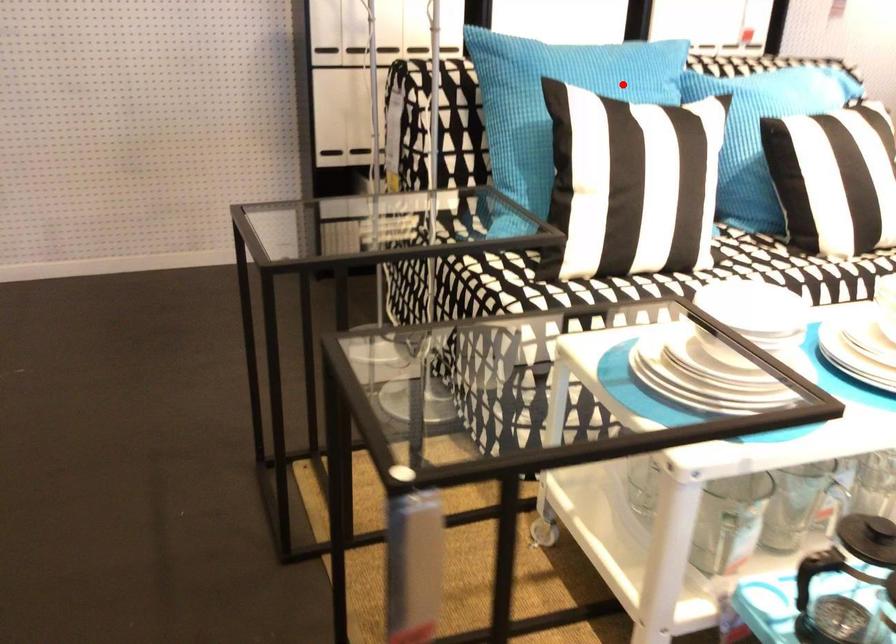
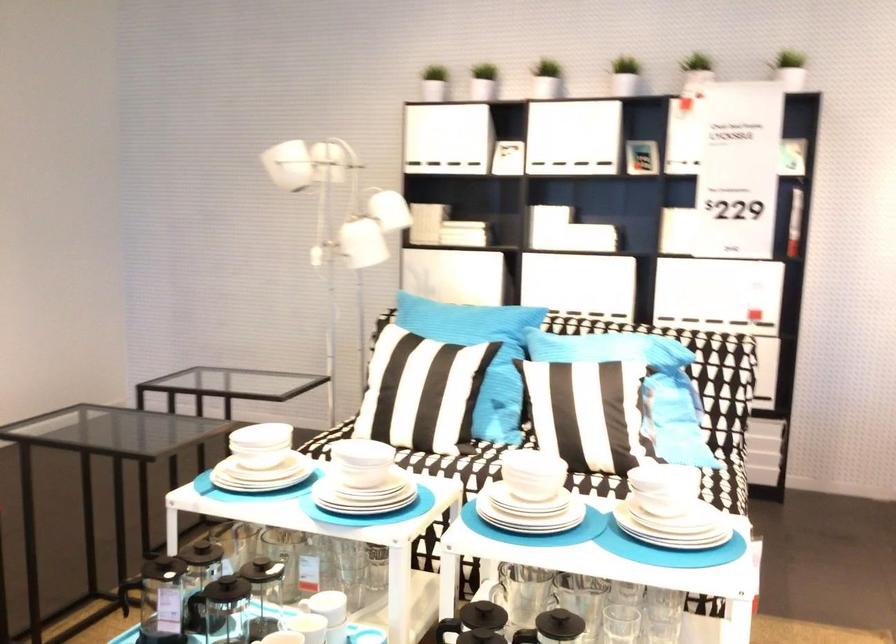
Question: A red point is marked in image1. In image2, is the corresponding 3D point closer to the camera or farther? Reply with the corresponding letter.

Choices:
 (A) The corresponding 3D point is closer.
 (B) The corresponding 3D point is farther.

Answer: (B)